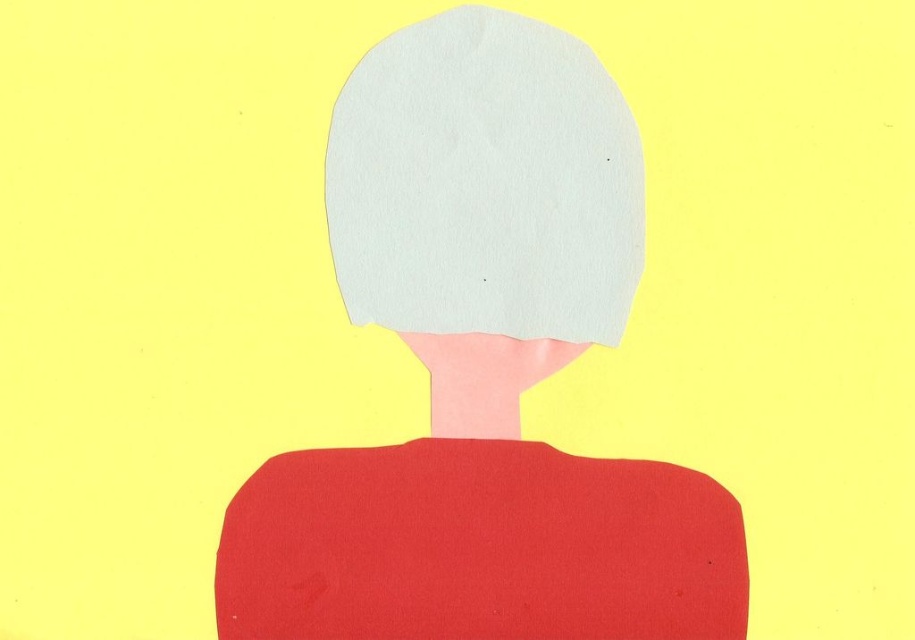
You are an artist trying to recreate the scene. You have two white paper cutouts. One is labeled as the white paper head at center and the other as the white paper at center. Which of the two white paper cutouts is taller?

The white paper head at center is taller than the white paper at center according to the description.

From the picture: You are an artist trying to place a small sticker on the white paper head at center in the image. You have a coordinate system where the bottom left corner is the origin. The point given is at coordinates (482,371). Is this point located on the white paper head at center?

Yes, the point (482,371) is on the white paper head at center according to the description.